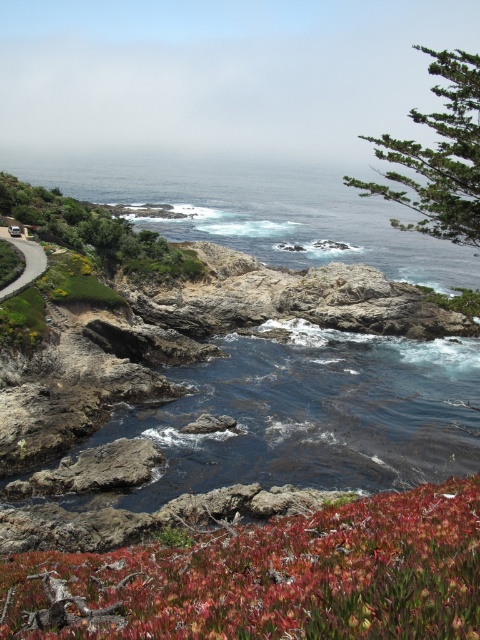
You are standing at the edge of the coastal landscape and want to take a photo of both the point at coordinates point (46, 218) and point (24, 252). Which point should you focus on first to ensure both are in clear view?

You should focus on point (46, 218) first because it is closer to the camera than point (24, 252). This ensures both points are in clear view.

Looking at this image, you are a hiker who wants to take a photo of the green leafy shrubs at upper left and the matte asphalt road at left. Which object should you focus on first if you want to capture both in one frame without moving your camera?

The green leafy shrubs at upper left should be focused on first because they are taller than the matte asphalt road at left, so adjusting focus to the taller shrubs ensures both are in the frame.

You are a hiker who wants to cross the rocky terrain to reach the blue water at center. There is a green matte plant at center in your path. Can you walk around it without stepping on the plant?

The green matte plant at center is thinner than blue water at center, so you can walk around it by moving to the side of the blue water at center.